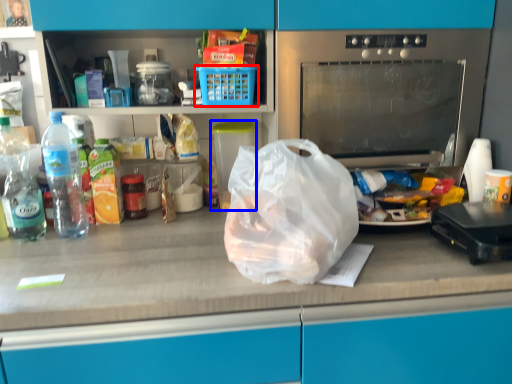
Question: Which object appears closest to the camera in this image, basket (highlighted by a red box) or appliance (highlighted by a blue box)?

Choices:
 (A) basket
 (B) appliance

Answer: (A)